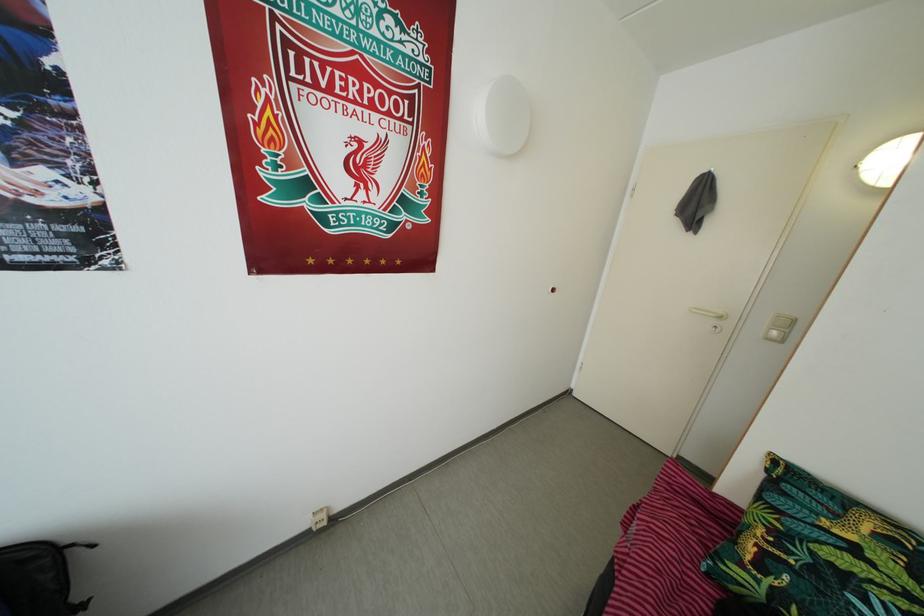
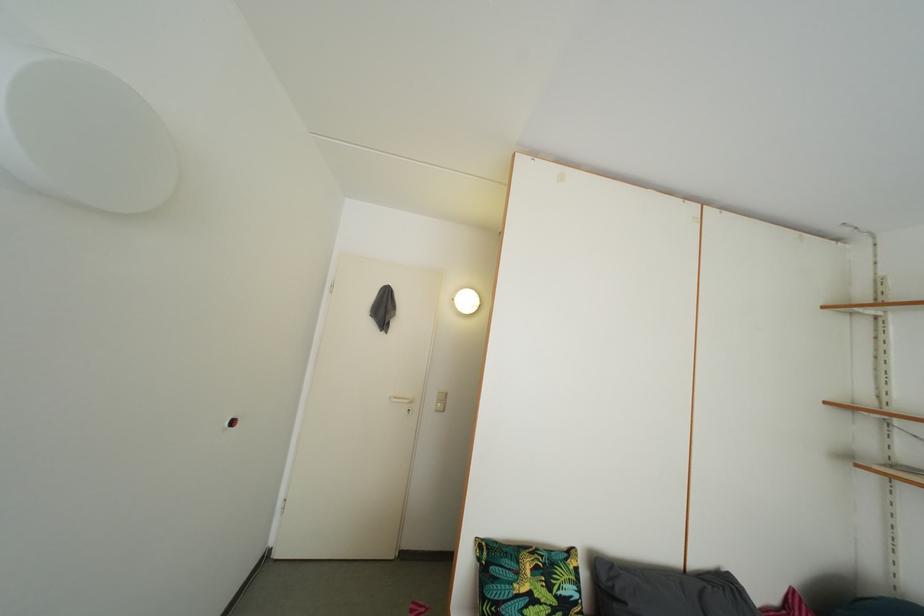
Locate, in the second image, the point that corresponds to point 850,509 in the first image.

(521, 562)